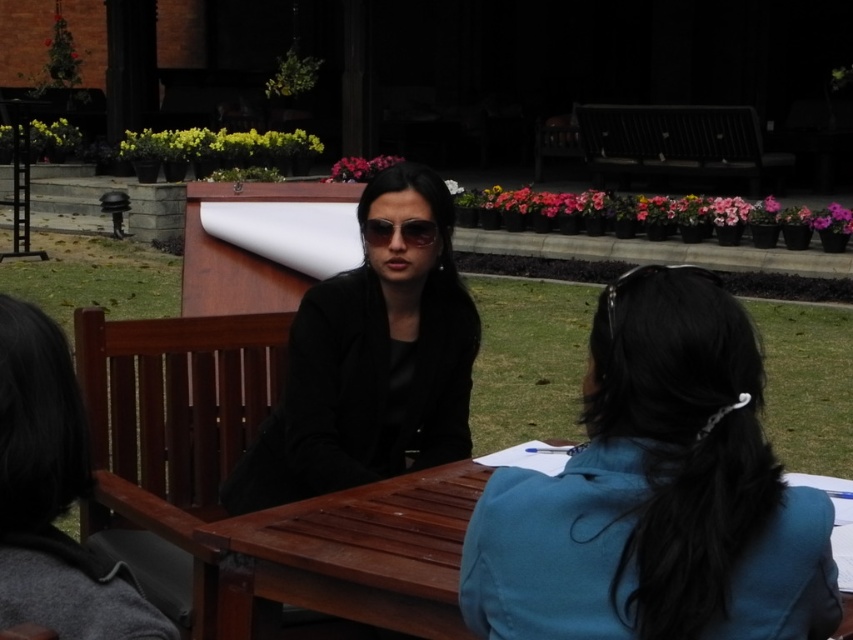
You are taking a photo of the scene and want to focus on both the point at point (392, 312) and the point at point (258, 561). Which point is closer to the camera?

Point (392, 312) is further to the camera than point (258, 561), so the point at point (258, 561) is closer to the camera.